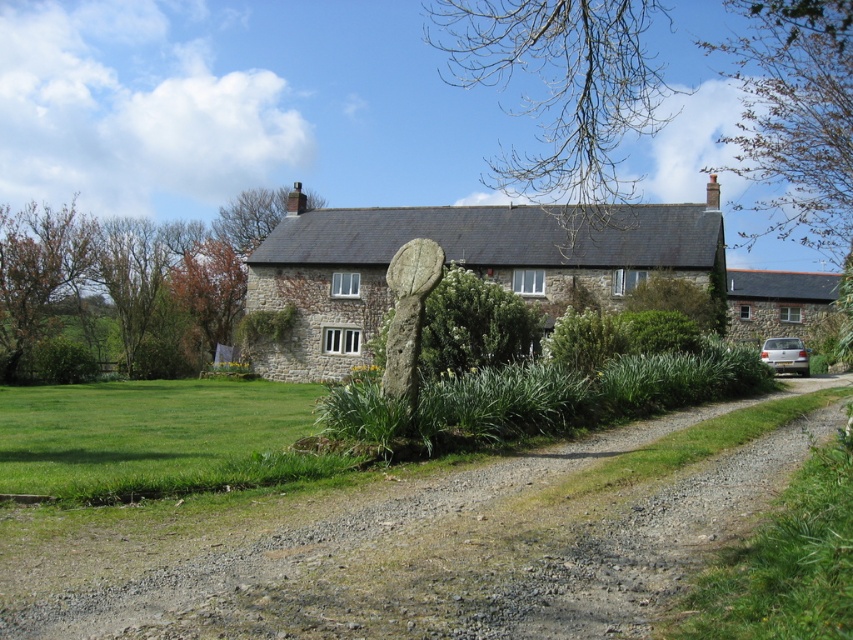
Who is taller, gravel at center or silver metallic car at right?

With more height is silver metallic car at right.

Measure the distance from gravel at center to silver metallic car at right.

gravel at center is 32.02 meters away from silver metallic car at right.

I want to click on gravel at center, so click(x=408, y=548).

Which is above, stone cottage at center or silver metallic car at right?

Positioned higher is stone cottage at center.

At what (x,y) coordinates should I click in order to perform the action: click on stone cottage at center. Please return your answer as a coordinate pair (x, y). This screenshot has width=853, height=640. Looking at the image, I should click on (457, 266).

Identify the location of stone cottage at center. (457, 266).

Does gravel at center have a lesser width compared to stone cottage at center?

Yes.

Does gravel at center have a greater width compared to stone cottage at center?

Incorrect, gravel at center's width does not surpass stone cottage at center's.

Which is in front, point (554, 625) or point (633, 212)?

Point (554, 625) is in front.

Identify the location of gravel at center. (408, 548).